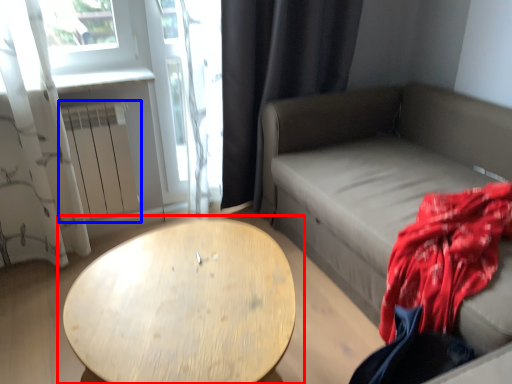
Question: Which object is closer to the camera taking this photo, table (highlighted by a red box) or radiator (highlighted by a blue box)?

Choices:
 (A) table
 (B) radiator

Answer: (A)